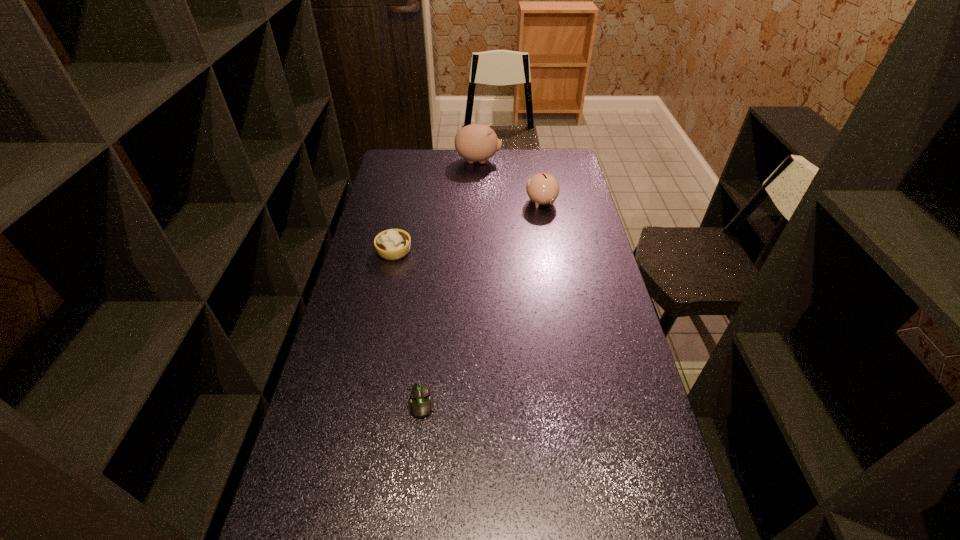
Where is `vacant space in between the third shortest object and the nearest object`? Image resolution: width=960 pixels, height=540 pixels. vacant space in between the third shortest object and the nearest object is located at coordinates (481, 302).

The image size is (960, 540). Identify the location of blank region between the whipped cream and the second object from right to left. (436, 206).

The image size is (960, 540). Find the location of `vacant point located between the shortest object and the third tallest object`. vacant point located between the shortest object and the third tallest object is located at coordinates (408, 327).

Find the location of a particular element. blank region between the second shortest object and the farther piggy bank is located at coordinates (436, 206).

Image resolution: width=960 pixels, height=540 pixels. Identify the location of free area in between the taller piggy bank and the shortest object. (450, 281).

You are a GUI agent. You are given a task and a screenshot of the screen. Output one action in this format:
    pyautogui.click(x=<x>, y=<y>)
    Task: Click on the vacant area that lies between the leftmost object and the tallest object
    The width and height of the screenshot is (960, 540).
    Given the screenshot: What is the action you would take?
    pyautogui.click(x=436, y=206)

Identify the location of unoccupied position between the taller piggy bank and the right piggy bank. Image resolution: width=960 pixels, height=540 pixels. (510, 182).

Where is `vacant area that lies between the nearest object and the third tallest object`? The image size is (960, 540). vacant area that lies between the nearest object and the third tallest object is located at coordinates (408, 327).

Choose which object is the nearest neighbor to the shortest object. Please provide its 2D coordinates. Your answer should be formatted as a tuple, i.e. [(x, y)], where the tuple contains the x and y coordinates of a point satisfying the conditions above.

[(392, 244)]

Locate which object is the third closest to the leftmost object. Please provide its 2D coordinates. Your answer should be formatted as a tuple, i.e. [(x, y)], where the tuple contains the x and y coordinates of a point satisfying the conditions above.

[(476, 142)]